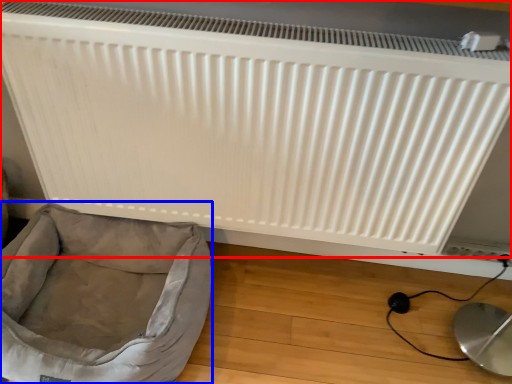
Question: Which of the following is the closest to the observer, radiator (highlighted by a red box) or dog bed (highlighted by a blue box)?

Choices:
 (A) radiator
 (B) dog bed

Answer: (A)